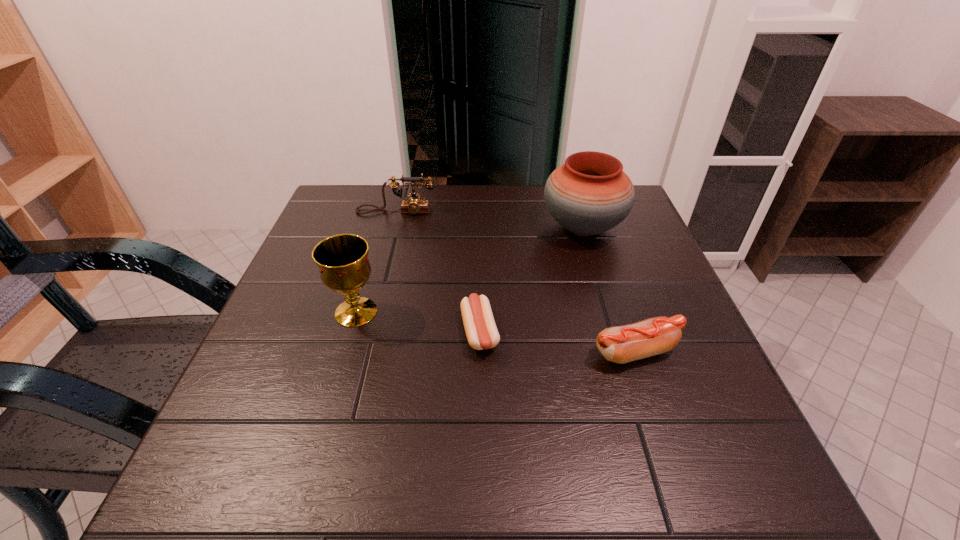
Locate an element on the screen. The height and width of the screenshot is (540, 960). vacant space situated on the back of the right sausage is located at coordinates (605, 259).

Where is `free region located on the left of the left sausage`? This screenshot has width=960, height=540. free region located on the left of the left sausage is located at coordinates (398, 333).

You are a GUI agent. You are given a task and a screenshot of the screen. Output one action in this format:
    pyautogui.click(x=<x>, y=<y>)
    Task: Click on the pottery that is at the far edge
    
    Given the screenshot: What is the action you would take?
    pyautogui.click(x=590, y=194)

Identify the location of telephone at the far edge. (414, 205).

Where is `chalice positioned at the left edge`? The width and height of the screenshot is (960, 540). chalice positioned at the left edge is located at coordinates (343, 261).

This screenshot has height=540, width=960. I want to click on telephone at the left edge, so click(414, 205).

Locate an element on the screen. pottery located in the right edge section of the desktop is located at coordinates (590, 194).

Find the location of a particular element. This screenshot has width=960, height=540. sausage at the right edge is located at coordinates (622, 344).

Where is `object present at the far left corner`? This screenshot has height=540, width=960. object present at the far left corner is located at coordinates [x=414, y=205].

The width and height of the screenshot is (960, 540). In order to click on object at the far right corner in this screenshot , I will do `click(590, 194)`.